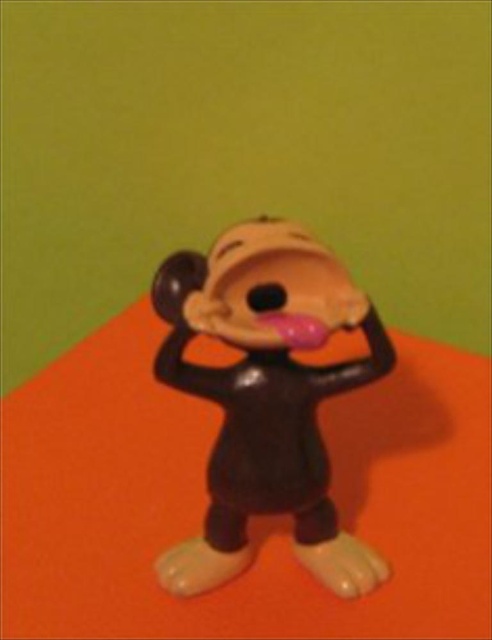
Question: Which of the following is the closest to the observer?

Choices:
 (A) orange matte table at center
 (B) matte plastic monkey at center

Answer: (A)

Question: Which object is closer to the camera taking this photo?

Choices:
 (A) matte plastic monkey at center
 (B) orange matte table at center

Answer: (B)

Question: Can you confirm if orange matte table at center is positioned above matte plastic monkey at center?

Choices:
 (A) yes
 (B) no

Answer: (B)

Question: Can you confirm if orange matte table at center is wider than matte plastic monkey at center?

Choices:
 (A) yes
 (B) no

Answer: (A)

Question: Where is orange matte table at center located in relation to matte plastic monkey at center in the image?

Choices:
 (A) below
 (B) above

Answer: (A)